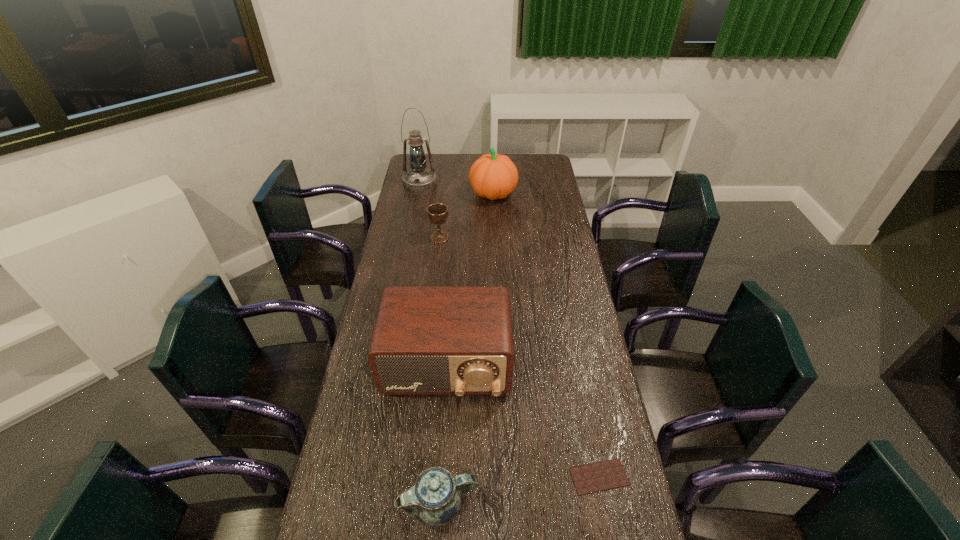
Locate an element on the screen. The width and height of the screenshot is (960, 540). blank space at the right edge of the desktop is located at coordinates (553, 231).

The image size is (960, 540). Identify the location of vacant region at the far left corner. (409, 165).

In order to click on free point at the far right corner in this screenshot , I will do `click(541, 174)`.

Locate an element on the screen. Image resolution: width=960 pixels, height=540 pixels. vacant area that lies between the radio receiver and the chocolate bar is located at coordinates (523, 421).

Locate an element on the screen. The width and height of the screenshot is (960, 540). free space that is in between the chocolate bar and the pumpkin is located at coordinates (546, 335).

Where is `free space between the pumpkin and the chalice`? Image resolution: width=960 pixels, height=540 pixels. free space between the pumpkin and the chalice is located at coordinates (467, 215).

The image size is (960, 540). What are the coordinates of `vacant area between the fifth tallest object and the rightmost object` in the screenshot? It's located at (519, 490).

Identify the location of unoccupied position between the chocolate bar and the fifth tallest object. The image size is (960, 540). (519, 490).

Locate an element on the screen. The height and width of the screenshot is (540, 960). empty location between the chinaware and the fourth farthest object is located at coordinates (444, 435).

Locate an element on the screen. vacant space in between the oil lamp and the radio receiver is located at coordinates (433, 274).